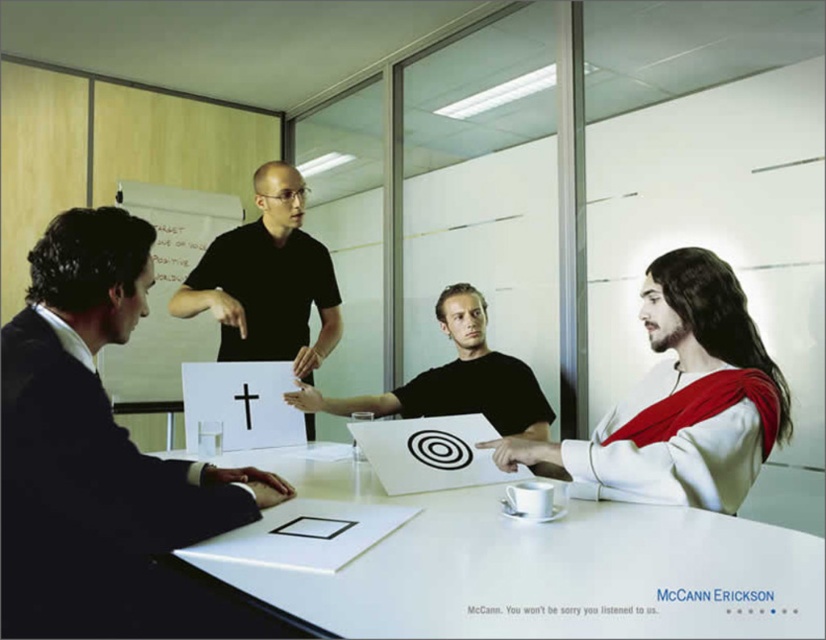
Question: Which point is closer to the camera?

Choices:
 (A) white matte jesus at right
 (B) white glossy table at center
 (C) black matte paper at center
 (D) black matte shirt at center

Answer: (B)

Question: Based on their relative distances, which object is nearer to the white matte jesus at right?

Choices:
 (A) black matte shirt at center
 (B) black matte paper at center

Answer: (B)

Question: Considering the real-world distances, which object is closest to the white glossy table at center?

Choices:
 (A) black matte shirt at upper center
 (B) black matte paper at center

Answer: (A)

Question: Can you confirm if white matte jesus at right is smaller than black matte shirt at center?

Choices:
 (A) no
 (B) yes

Answer: (B)

Question: Is white glossy table at center above white matte jesus at right?

Choices:
 (A) yes
 (B) no

Answer: (B)

Question: Does white matte jesus at right have a lesser width compared to black matte shirt at center?

Choices:
 (A) yes
 (B) no

Answer: (B)